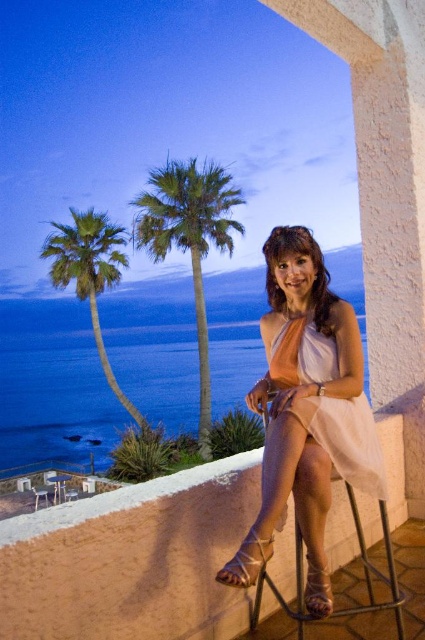
You are a photographer setting up a shot of the scene. You need to ensure the white satin dress at center is fully visible without being blocked by the metallic silver bar stool at lower right. Based on their heights, will the dress be visible above the stool?

The white satin dress at center is taller than the metallic silver bar stool at lower right, so yes, the dress will be visible above the stool.

You are a photographer trying to capture the scene with the green leafy palm tree at left and the satin beige sandal at lower center. Which object should you focus on first if you want to ensure both are in the frame without moving the camera?

The green leafy palm tree at left should be focused on first since it is positioned on the left side of the satin beige sandal at lower center, ensuring both are within the frame.